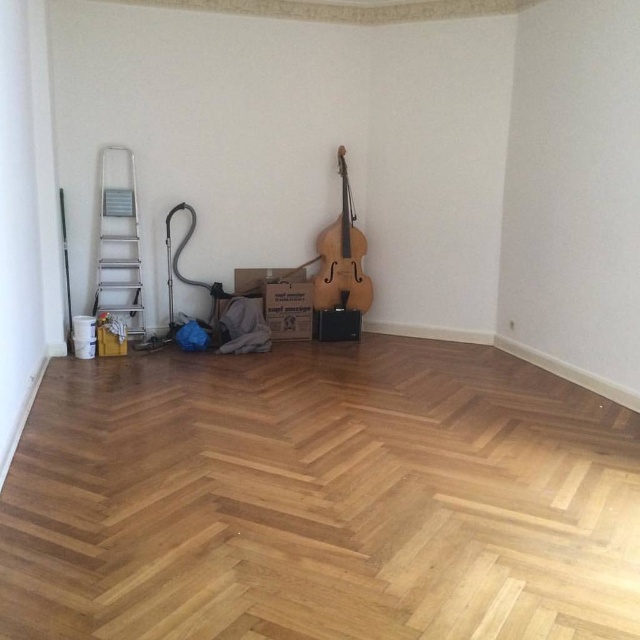
Question: Which point is closer to the camera?

Choices:
 (A) 104,323
 (B) 269,326
 (C) 134,330
 (D) 346,260

Answer: (A)

Question: Observing the image, what is the correct spatial positioning of wooden cello at center in reference to brown cardboard box at center?

Choices:
 (A) right
 (B) left

Answer: (A)

Question: Which is farther from the brown cardboard box at center?

Choices:
 (A) wooden cello at center
 (B) brown cardboard box at lower left

Answer: (B)

Question: Can you confirm if wooden cello at center is positioned to the left of brown cardboard box at center?

Choices:
 (A) no
 (B) yes

Answer: (A)

Question: Is brown cardboard box at center wider than brown cardboard box at lower left?

Choices:
 (A) no
 (B) yes

Answer: (B)

Question: Which of the following is the farthest from the observer?

Choices:
 (A) (104, 321)
 (B) (346, 234)
 (C) (304, 300)
 (D) (115, 278)

Answer: (B)